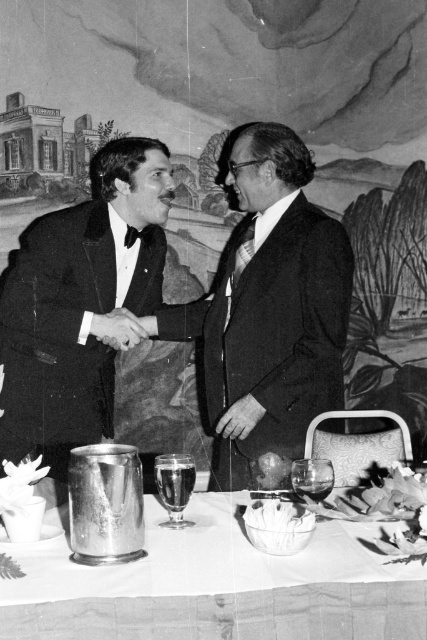
Can you confirm if shiny black suit at center is shorter than metallic silver pitcher at lower center?

Incorrect, shiny black suit at center's height does not fall short of metallic silver pitcher at lower center's.

Who is more distant from viewer, (269,253) or (175,545)?

Positioned behind is point (269,253).

Between point (292, 368) and point (274, 573), which one is positioned behind?

Positioned behind is point (292, 368).

I want to click on shiny black suit at center, so click(x=190, y=317).

Does metallic silver pitcher at lower center have a smaller size compared to shiny black tuxedo at center?

Answer: Indeed, metallic silver pitcher at lower center has a smaller size compared to shiny black tuxedo at center.

The image size is (427, 640). Describe the element at coordinates (219, 588) in the screenshot. I see `metallic silver pitcher at lower center` at that location.

Identify the location of metallic silver pitcher at lower center. click(x=219, y=588).

Is point (76, 301) in front of point (99, 374)?

That is True.

Between shiny black suit at center and shiny black tuxedo at center, which one is positioned lower?

Positioned lower is shiny black suit at center.

Which is in front, point (29, 353) or point (73, 312)?

Point (73, 312) is more forward.

Where is `shiny black suit at center`? This screenshot has height=640, width=427. shiny black suit at center is located at coordinates (190, 317).